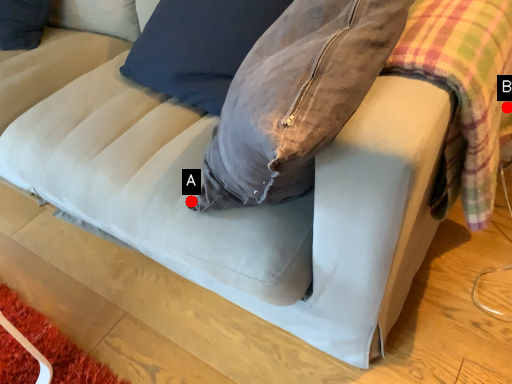
Question: Two points are circled on the image, labeled by A and B beside each circle. Which point is farther from the camera taking this photo?

Choices:
 (A) A is further
 (B) B is further

Answer: (A)